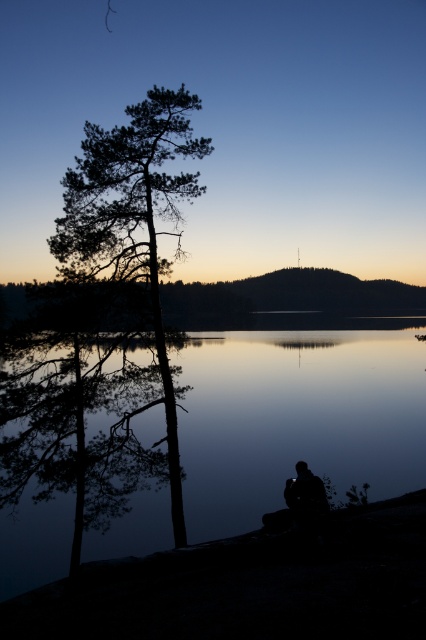
You are an artist trying to paint the scene. You want to place a boat on the silvery reflective water at center. Where exactly should you position the boat on the canvas to ensure it floats on the water?

You should position the boat at the coordinates point (296, 419) to ensure it floats on the silvery reflective water at center.

You are standing at the base of the hill and looking towards the distant horizon. You notice two points marked in the scene. Which point, point (268, 422) or point (129, 252), is closer to your current position?

Point (129, 252) is closer to your current position because it is closer to the camera than point (268, 422).